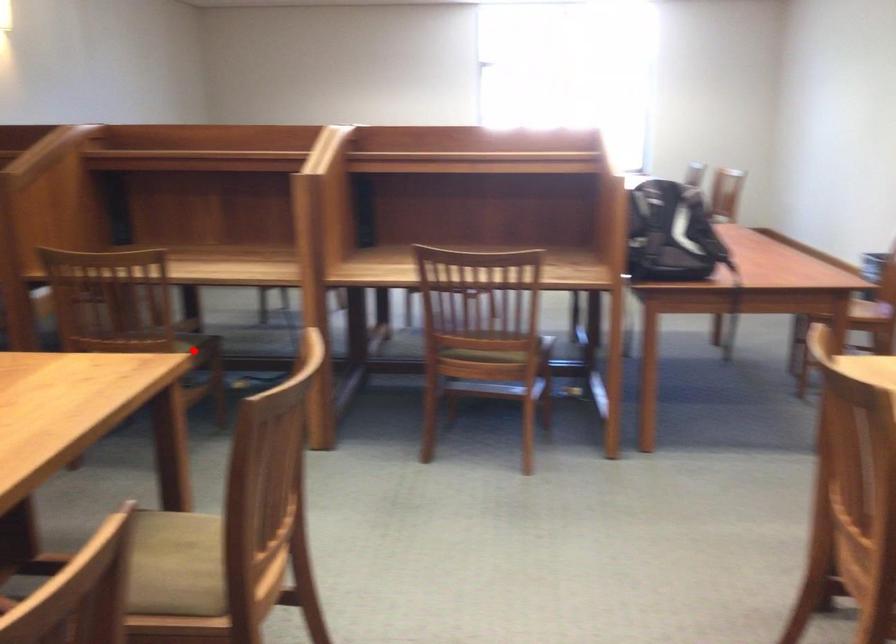
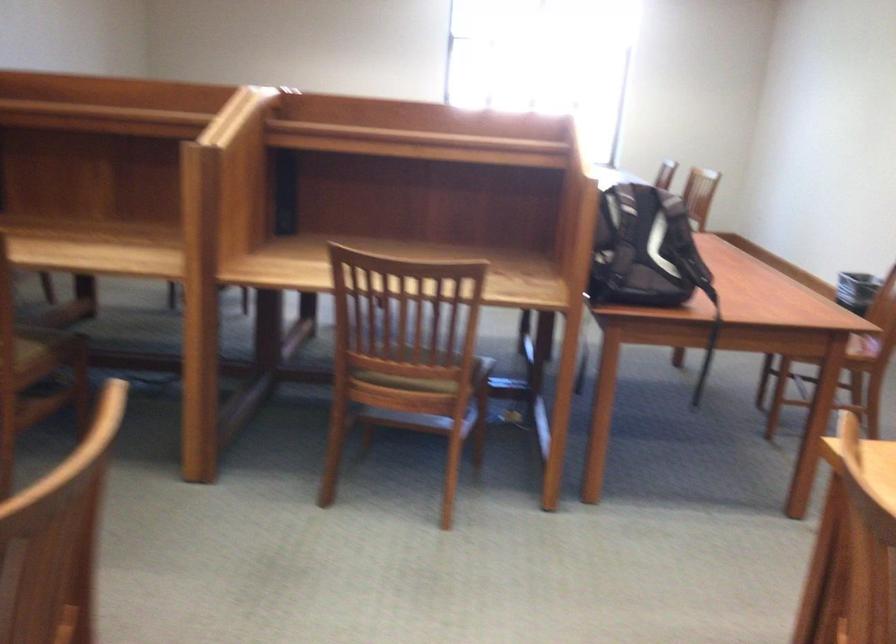
Question: I am providing you with two images of the same scene from different viewpoints. Image1 has a red point marked. In image2, the corresponding 3D location appears at what relative position? Reply with the corresponding letter.

Choices:
 (A) Closer
 (B) Farther

Answer: (A)